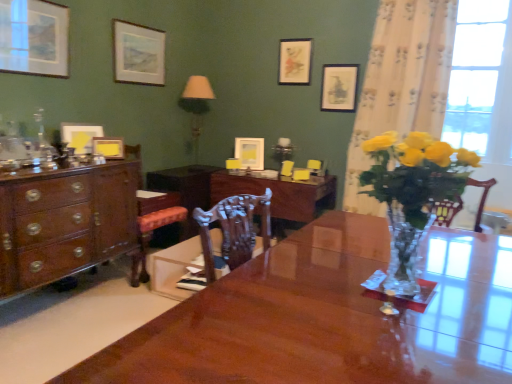
Question: Is matte paper picture frame at upper center, the 6th picture frame when ordered from left to right, positioned before glossy wood desk at center?

Choices:
 (A) no
 (B) yes

Answer: (A)

Question: Is glossy wood desk at center located within matte paper picture frame at upper center, the 2th picture frame viewed from the right?

Choices:
 (A) no
 (B) yes

Answer: (A)

Question: From the image's perspective, would you say matte paper picture frame at upper center, the 2th picture frame viewed from the right, is positioned over glossy wood desk at center?

Choices:
 (A) yes
 (B) no

Answer: (A)

Question: Considering the relative sizes of matte paper picture frame at upper center, the 2th picture frame viewed from the right, and glossy wood desk at center in the image provided, is matte paper picture frame at upper center, the 2th picture frame viewed from the right, shorter than glossy wood desk at center?

Choices:
 (A) yes
 (B) no

Answer: (A)

Question: Is matte paper picture frame at upper center, the 2th picture frame viewed from the right, located outside glossy wood desk at center?

Choices:
 (A) no
 (B) yes

Answer: (B)

Question: Is point (291, 173) positioned closer to the camera than point (187, 94)?

Choices:
 (A) closer
 (B) farther

Answer: (A)

Question: Is wooden armchair at center, acting as the 2th armchair starting from the right, bigger or smaller than translucent glass lamp at upper center?

Choices:
 (A) small
 (B) big

Answer: (A)

Question: From the image's perspective, is wooden armchair at center, acting as the 2th armchair starting from the right, positioned above or below translucent glass lamp at upper center?

Choices:
 (A) below
 (B) above

Answer: (A)

Question: From their relative heights in the image, would you say wooden armchair at center, acting as the 2th armchair starting from the right, is taller or shorter than translucent glass lamp at upper center?

Choices:
 (A) short
 (B) tall

Answer: (A)

Question: Considering their positions, is wooden armchair at center, the 1th armchair positioned from the right, located in front of or behind matte white picture frame at upper center, the fourth picture frame viewed from the left?

Choices:
 (A) front
 (B) behind

Answer: (B)

Question: Would you say wooden armchair at center, the 1th armchair positioned from the right, is to the left or to the right of matte white picture frame at upper center, which is the 4th picture frame from right to left, in the picture?

Choices:
 (A) left
 (B) right

Answer: (B)

Question: Is wooden armchair at center, the 1th armchair positioned from the right, taller or shorter than matte white picture frame at upper center, the fourth picture frame viewed from the left?

Choices:
 (A) short
 (B) tall

Answer: (A)

Question: Is wooden armchair at center, the 1th armchair positioned from the right, wider or thinner than matte white picture frame at upper center, the fourth picture frame viewed from the left?

Choices:
 (A) wide
 (B) thin

Answer: (A)

Question: In terms of size, does glossy wood desk at center appear bigger or smaller than wooden armchair at center, which appears as the 2th armchair when viewed from the left?

Choices:
 (A) big
 (B) small

Answer: (A)

Question: Visually, is glossy wood desk at center positioned to the left or to the right of wooden armchair at center, which appears as the 2th armchair when viewed from the left?

Choices:
 (A) right
 (B) left

Answer: (B)